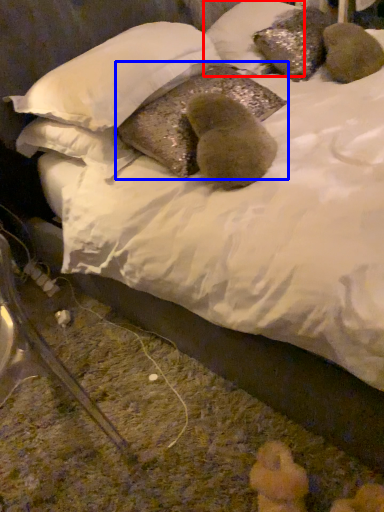
Question: Which of the following is the farthest to the observer, pillow (highlighted by a red box) or pillow (highlighted by a blue box)?

Choices:
 (A) pillow
 (B) pillow

Answer: (A)